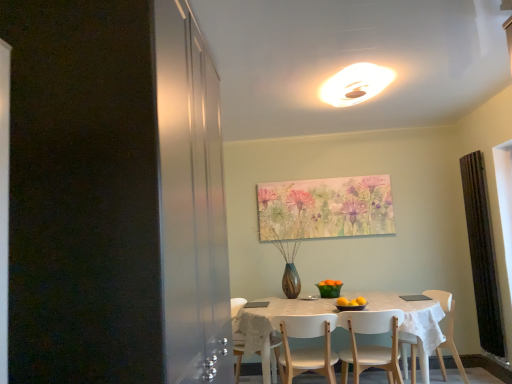
Question: Considering the positions of point (393, 322) and point (502, 342), is point (393, 322) closer or farther from the camera than point (502, 342)?

Choices:
 (A) closer
 (B) farther

Answer: (A)

Question: From a real-world perspective, is white matte chair at lower center, which appears as the 2th chair when viewed from the right, above or below black textured curtain at right?

Choices:
 (A) above
 (B) below

Answer: (B)

Question: Estimate the real-world distances between objects in this image. Which object is closer to the white glossy light fixture at upper center?

Choices:
 (A) white wood chair at center, which appears as the 1th chair when viewed from the left
 (B) white matte chair at lower center, which appears as the 2th chair when viewed from the right
 (C) white matte chair at lower right, acting as the third chair starting from the left
 (D) white glossy table at center
 (E) black textured curtain at right

Answer: (D)

Question: Estimate the real-world distances between objects in this image. Which object is farther from the white matte chair at lower right, acting as the third chair starting from the left?

Choices:
 (A) watercolor canvas at upper center
 (B) black textured curtain at right
 (C) white glossy table at center
 (D) white wood chair at center, the 3th chair in the right-to-left sequence
 (E) white matte chair at lower center, which appears as the 2th chair when viewed from the right

Answer: (A)